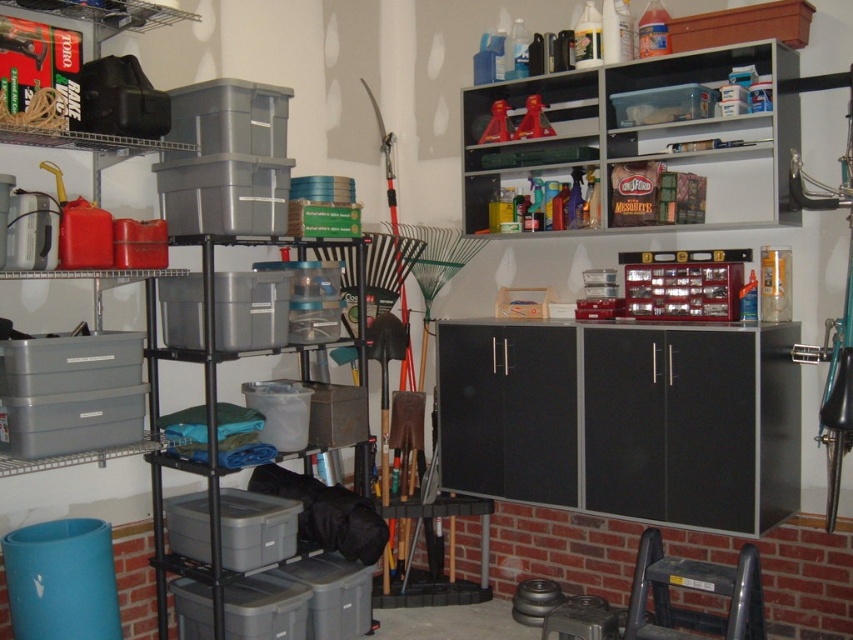
Question: Estimate the real-world distances between objects in this image. Which object is closer to the gray plastic shelves at center left?

Choices:
 (A) matte plastic shelf at upper center
 (B) gray plastic bins at left

Answer: (B)

Question: Does matte plastic shelf at upper center have a smaller size compared to gray plastic bins at left?

Choices:
 (A) no
 (B) yes

Answer: (A)

Question: Does gray plastic bins at left appear on the left side of gray plastic shelves at center left?

Choices:
 (A) no
 (B) yes

Answer: (B)

Question: Which point is farther to the camera?

Choices:
 (A) gray plastic bins at left
 (B) matte plastic shelf at upper center

Answer: (B)

Question: Estimate the real-world distances between objects in this image. Which object is farther from the matte plastic shelf at upper center?

Choices:
 (A) gray plastic shelves at center left
 (B) gray plastic bins at left

Answer: (B)

Question: Does matte plastic shelf at upper center appear on the left side of gray plastic shelves at center left?

Choices:
 (A) no
 (B) yes

Answer: (A)